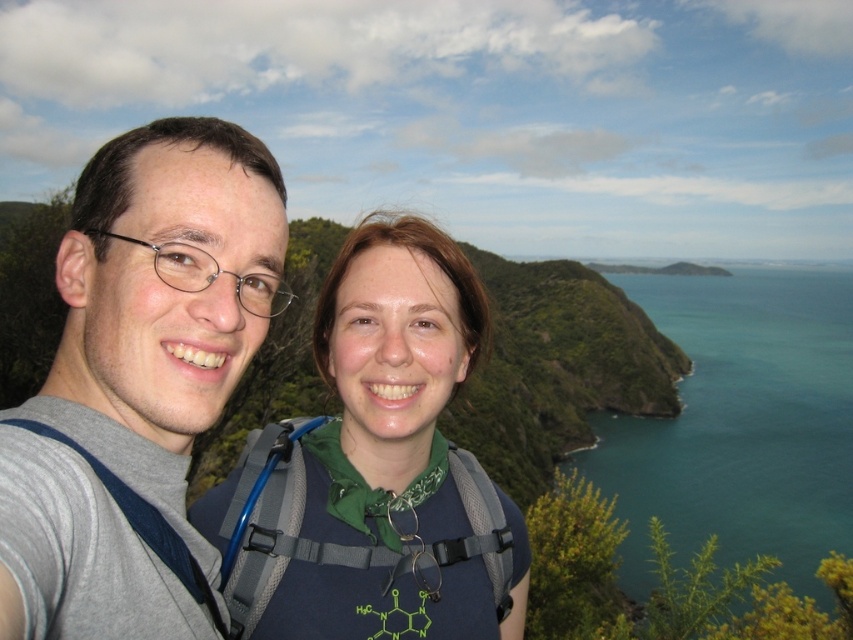
You are planning to take a photo of the blue fabric backpack at center and the teal glossy water at upper right. Which object is narrower in the image?

The blue fabric backpack at center has a lesser width compared to the teal glossy water at upper right, so the blue fabric backpack at center is narrower.

You are a photographer trying to capture both the gray fabric shirt at left and the blue fabric backpack at center in a single frame. Which object should you focus on first to ensure both are in the frame?

The gray fabric shirt at left is bigger than the blue fabric backpack at center, so you should focus on the gray fabric shirt at left first to ensure both are in the frame.